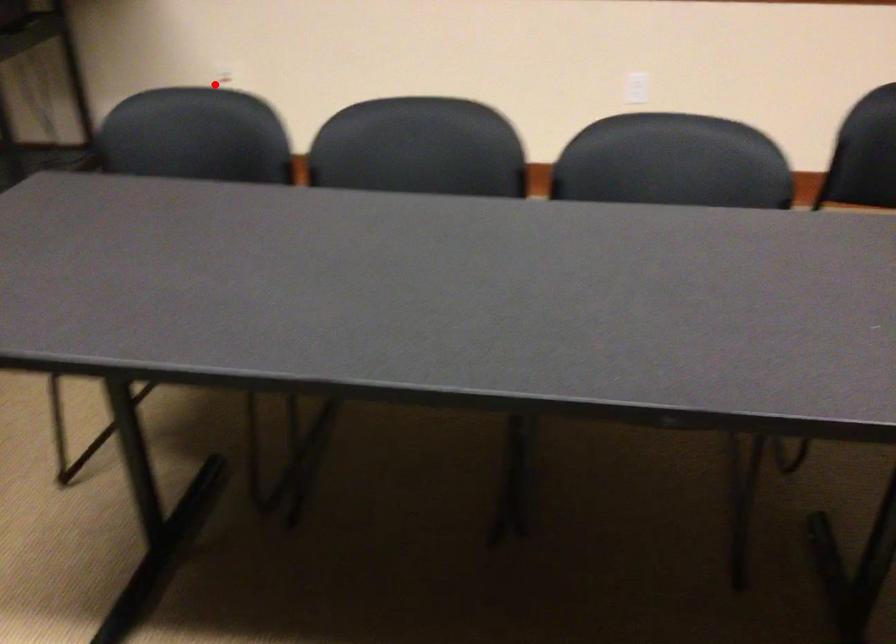
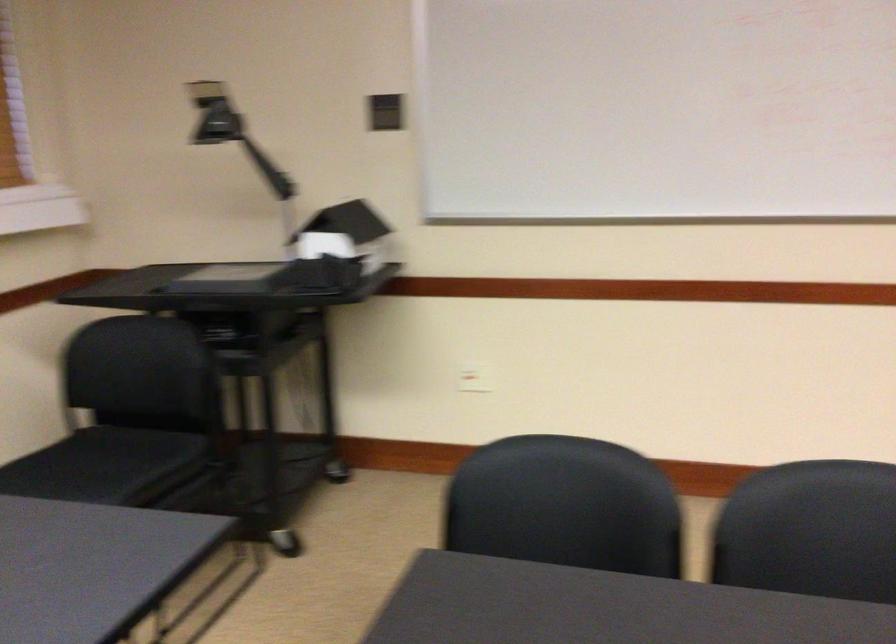
Locate, in the second image, the point that corresponds to the highlighted location in the first image.

(474, 377)